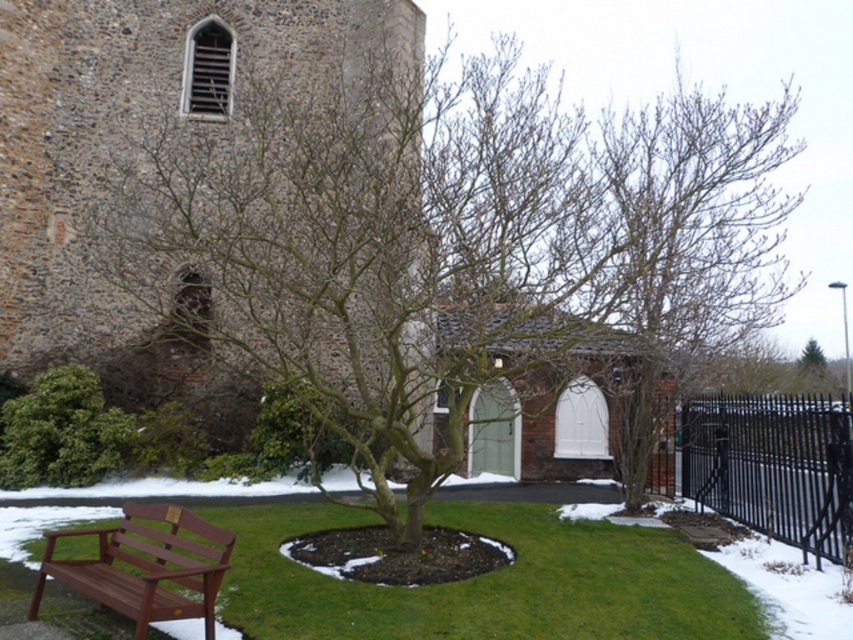
Question: Is the position of brown stone church at upper left less distant than that of green grass at lower left?

Choices:
 (A) yes
 (B) no

Answer: (B)

Question: Does brown stone church at upper left have a smaller size compared to mahogany wood bench at lower left?

Choices:
 (A) no
 (B) yes

Answer: (A)

Question: Estimate the real-world distances between objects in this image. Which object is farther from the brown stone church at upper left?

Choices:
 (A) black wrought iron fence at lower right
 (B) green grass at lower left
 (C) mahogany wood bench at lower left

Answer: (A)

Question: Which of these objects is positioned closest to the black wrought iron fence at lower right?

Choices:
 (A) brown stone church at upper left
 (B) mahogany wood bench at lower left
 (C) green grass at lower left

Answer: (C)

Question: Among these objects, which one is nearest to the camera?

Choices:
 (A) brown stone church at upper left
 (B) green grass at lower left
 (C) mahogany wood bench at lower left
 (D) black wrought iron fence at lower right

Answer: (C)

Question: Does black wrought iron fence at lower right appear on the left side of mahogany wood bench at lower left?

Choices:
 (A) yes
 (B) no

Answer: (B)